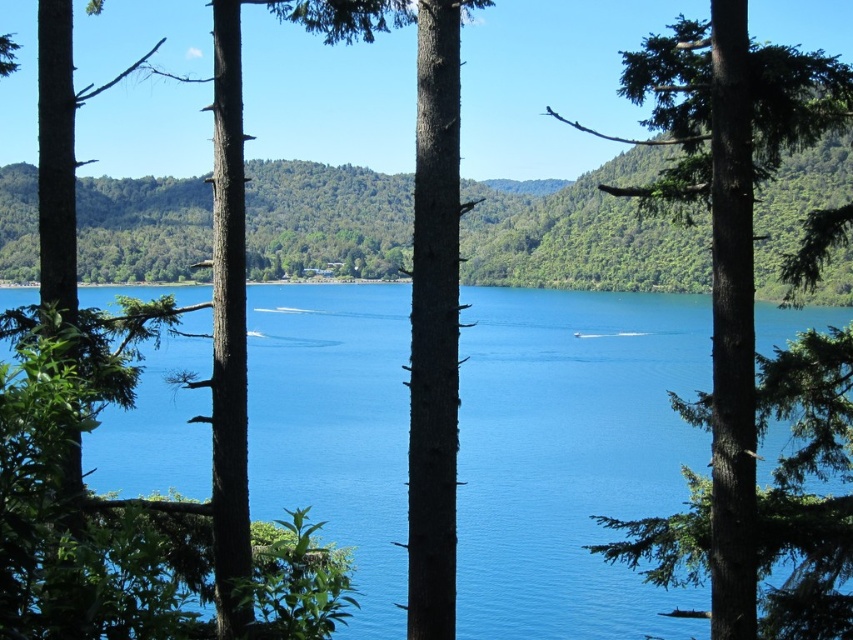
Can you confirm if blue water at center is positioned to the right of green textured tree at right?

In fact, blue water at center is to the left of green textured tree at right.

Who is more forward, (672, 465) or (656, 35)?

Point (672, 465) is in front.

Does point (460, 296) lie in front of point (730, 451)?

No, it is not.

Where is `blue water at center`? This screenshot has width=853, height=640. blue water at center is located at coordinates (572, 458).